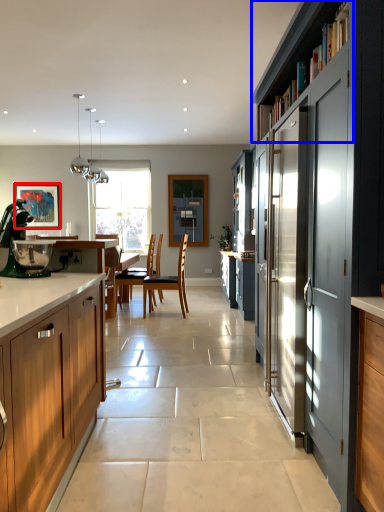
Question: Which object appears closest to the camera in this image, picture frame (highlighted by a red box) or shelf (highlighted by a blue box)?

Choices:
 (A) picture frame
 (B) shelf

Answer: (B)